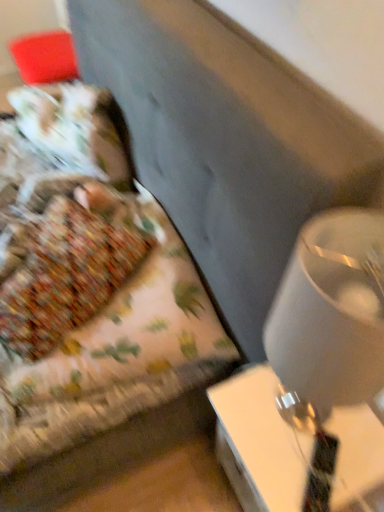
You are a GUI agent. You are given a task and a screenshot of the screen. Output one action in this format:
    pyautogui.click(x=<x>, y=<y>)
    Task: Click on the floral fabric bed at left
    This screenshot has height=512, width=384.
    Given the screenshot: What is the action you would take?
    (88, 286)

What do you see at coordinates (330, 316) in the screenshot? This screenshot has width=384, height=512. I see `white glossy lampshade at right` at bounding box center [330, 316].

Find the location of a particular element. The width and height of the screenshot is (384, 512). floral fabric bed at left is located at coordinates (88, 286).

Choose the correct answer: Is floral fabric bed at left inside white glossy lampshade at right or outside it?

floral fabric bed at left exists outside the volume of white glossy lampshade at right.

Is floral fabric bed at left turned away from white glossy lampshade at right?

That's not correct — floral fabric bed at left is not looking away from white glossy lampshade at right.

Consider the image. Can you confirm if floral fabric bed at left is positioned to the right of white glossy lampshade at right?

No, floral fabric bed at left is not to the right of white glossy lampshade at right.

Is white glossy table at lower right turned away from floral fabric bed at left?

No, white glossy table at lower right's orientation is not away from floral fabric bed at left.

In the scene shown: Does white glossy table at lower right have a lesser height compared to floral fabric bed at left?

Incorrect, the height of white glossy table at lower right does not fall short of that of floral fabric bed at left.

Between point (285, 481) and point (104, 96), which one is positioned in front?

The point (285, 481) is in front.

Is white glossy table at lower right not within floral fabric bed at left?

Indeed, white glossy table at lower right is completely outside floral fabric bed at left.

Considering the points (234, 443) and (298, 279), which point is behind, point (234, 443) or point (298, 279)?

The point (234, 443) is farther.

Is white glossy table at lower right facing away from white glossy lampshade at right?

white glossy table at lower right does not have its back to white glossy lampshade at right.

Consider the image. Considering the relative sizes of white glossy table at lower right and white glossy lampshade at right in the image provided, is white glossy table at lower right bigger than white glossy lampshade at right?

Indeed, white glossy table at lower right has a larger size compared to white glossy lampshade at right.

Is white glossy table at lower right to the left or to the right of white glossy lampshade at right in the image?

In the image, white glossy table at lower right appears on the right side of white glossy lampshade at right.

Is white glossy lampshade at right situated inside floral fabric bed at left or outside?

white glossy lampshade at right lies outside floral fabric bed at left.

From the image's perspective, is white glossy lampshade at right under floral fabric bed at left?

Yes, from the image's perspective, white glossy lampshade at right is beneath floral fabric bed at left.

Is point (362, 354) farther from viewer compared to point (88, 397)?

That is False.

The image size is (384, 512). What are the coordinates of `bed located behind the white glossy lampshade at right` in the screenshot? It's located at (88, 286).

Is floral fabric bed at left facing towards white glossy table at lower right?

No.

Is floral fabric bed at left inside the boundaries of white glossy table at lower right, or outside?

floral fabric bed at left is located beyond the bounds of white glossy table at lower right.

In the scene shown: Can you confirm if floral fabric bed at left is thinner than white glossy table at lower right?

In fact, floral fabric bed at left might be wider than white glossy table at lower right.

Considering the sizes of objects white glossy lampshade at right and white glossy table at lower right in the image provided, who is thinner, white glossy lampshade at right or white glossy table at lower right?

white glossy lampshade at right is thinner.

From the image's perspective, which one is positioned lower, white glossy lampshade at right or white glossy table at lower right?

white glossy table at lower right.

Where is `table lamp on the left of white glossy table at lower right`? The width and height of the screenshot is (384, 512). table lamp on the left of white glossy table at lower right is located at coordinates (330, 316).

Identify the location of table lamp in front of the floral fabric bed at left. (330, 316).

This screenshot has height=512, width=384. In order to click on bed to the left of white glossy table at lower right in this screenshot , I will do `click(88, 286)`.

Which object lies nearer to the anchor point floral fabric bed at left, white glossy lampshade at right or white glossy table at lower right?

Among the two, white glossy table at lower right is located nearer to floral fabric bed at left.

Consider the image. Which object lies nearer to the anchor point white glossy table at lower right, floral fabric bed at left or white glossy lampshade at right?

Among the two, white glossy lampshade at right is located nearer to white glossy table at lower right.

Considering their positions, is white glossy lampshade at right positioned closer to white glossy table at lower right than floral fabric bed at left?

white glossy lampshade at right is closer to white glossy table at lower right.

Based on their spatial positions, is white glossy table at lower right or white glossy lampshade at right further from floral fabric bed at left?

white glossy lampshade at right lies further to floral fabric bed at left than the other object.

Estimate the real-world distances between objects in this image. Which object is further from white glossy lampshade at right, floral fabric bed at left or white glossy table at lower right?

Among the two, floral fabric bed at left is located further to white glossy lampshade at right.

Which object lies nearer to the anchor point white glossy lampshade at right, white glossy table at lower right or floral fabric bed at left?

white glossy table at lower right lies closer to white glossy lampshade at right than the other object.

Image resolution: width=384 pixels, height=512 pixels. In order to click on table lamp situated between floral fabric bed at left and white glossy table at lower right from left to right in this screenshot , I will do `click(330, 316)`.